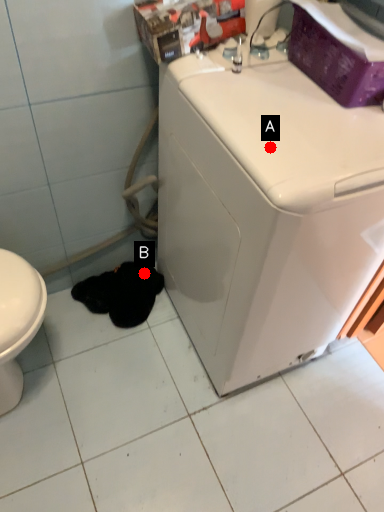
Question: Two points are circled on the image, labeled by A and B beside each circle. Which of the following is the closest to the observer?

Choices:
 (A) A is closer
 (B) B is closer

Answer: (A)